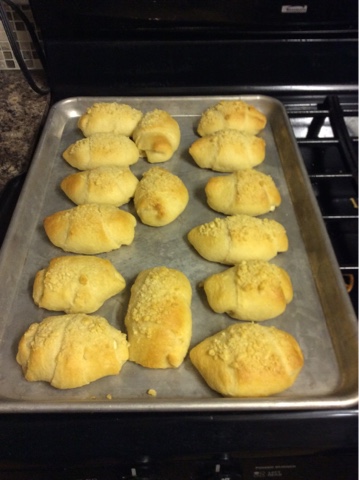
The width and height of the screenshot is (359, 480). In order to click on tray in this screenshot , I will do `click(322, 363)`.